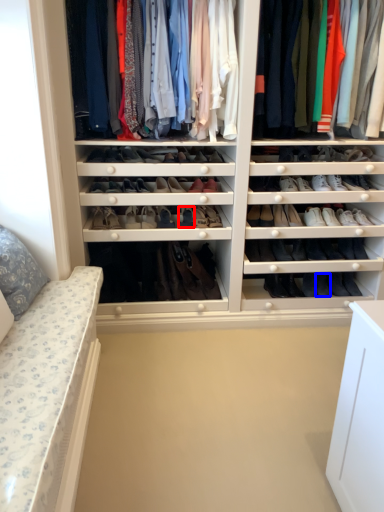
Question: Which of the following is the farthest to the observer, shoe (highlighted by a red box) or shoe (highlighted by a blue box)?

Choices:
 (A) shoe
 (B) shoe

Answer: (B)